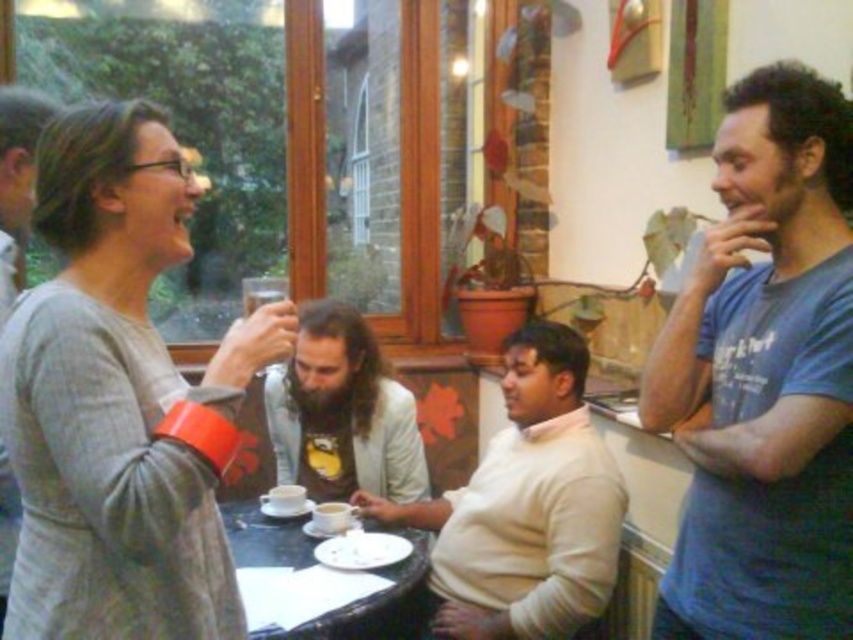
Where is the white matte sweater at center located in the image?

The white matte sweater at center is located at point (x=525, y=508) in the image.

You are a delivery person carrying a package that is 1 meter wide. You need to pass between the gray matte sweater at upper left and the white matte sweater at center to deliver the package. Can you fit through the space between them?

The distance between the gray matte sweater at upper left and the white matte sweater at center is 1.01 meters, so the package that is 1 meter wide can fit through the space between them since it is slightly wider than the package.

You are a photographer trying to capture a candid shot of the white matte sweater at center and the matte ceramic cup at center. Since you want to focus on the sweater, which object should you adjust your camera focus to prioritize?

The white matte sweater at center is in front of the matte ceramic cup at center, so to prioritize focusing on the sweater, adjust the camera focus to the white matte sweater at center.